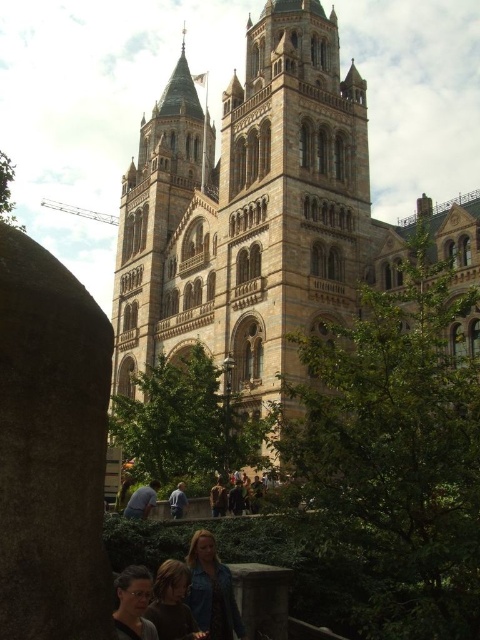
Who is taller, brown stone church at center or matte black glasses at lower center?

Standing taller between the two is brown stone church at center.

Can you confirm if brown stone church at center is wider than matte black glasses at lower center?

Answer: Correct, the width of brown stone church at center exceeds that of matte black glasses at lower center.

Where is `brown stone church at center`? Image resolution: width=480 pixels, height=640 pixels. brown stone church at center is located at coordinates (251, 211).

At what (x,y) coordinates should I click in order to perform the action: click on brown stone church at center. Please return your answer as a coordinate pair (x, y). Looking at the image, I should click on (251, 211).

Is the position of light blue shirt at lower center less distant than that of light blue shirt at center?

That is True.

Who is taller, light blue shirt at lower center or light blue shirt at center?

light blue shirt at lower center

Measure the distance between light blue shirt at lower center and camera.

They are 163.82 feet apart.

Identify the location of light blue shirt at lower center. (142, 500).

Who is more distant from viewer, (170, 620) or (145, 497)?

Positioned behind is point (145, 497).

Where is `dark brown leather jacket at lower center`? The width and height of the screenshot is (480, 640). dark brown leather jacket at lower center is located at coordinates (171, 604).